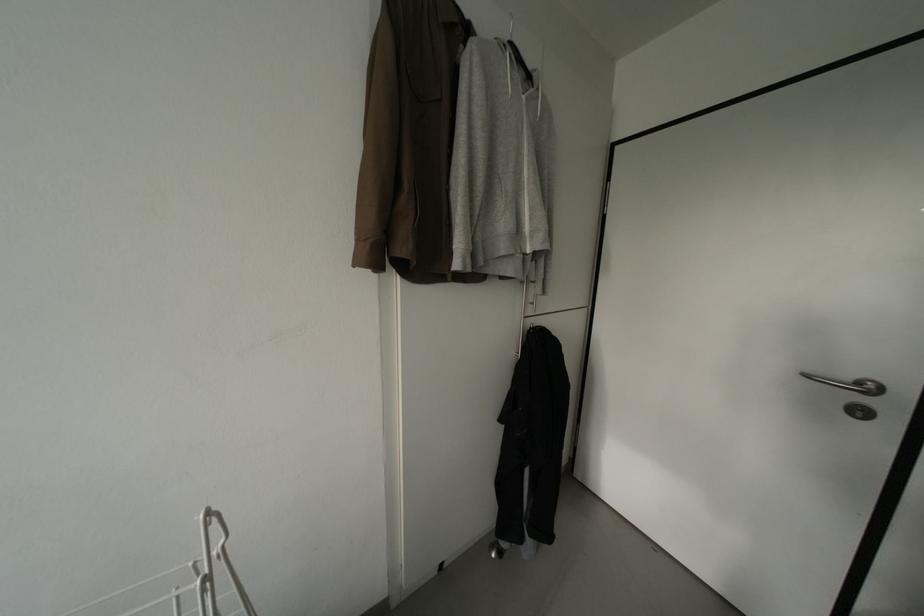
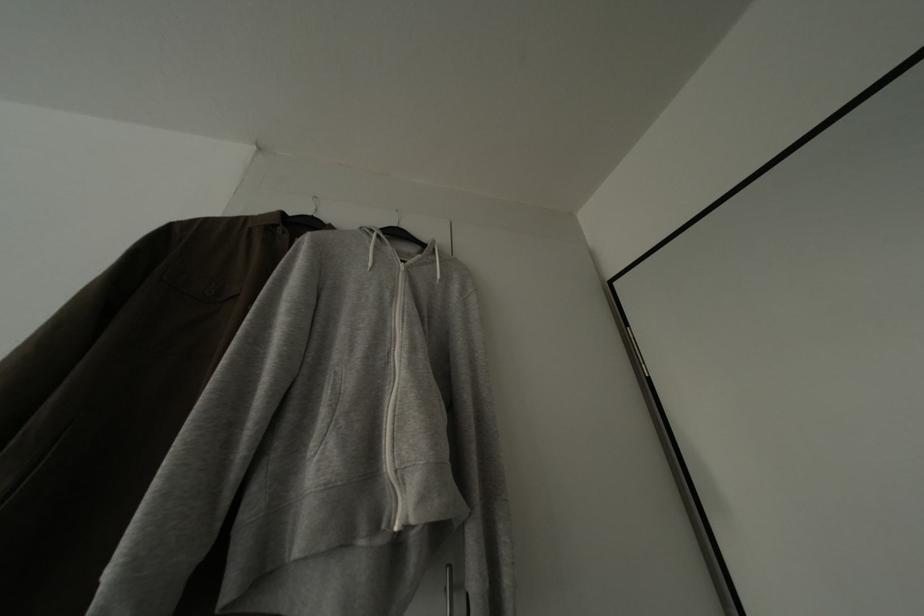
Based on the continuous images, in which direction is the camera rotating?

The camera rotated toward left-up.